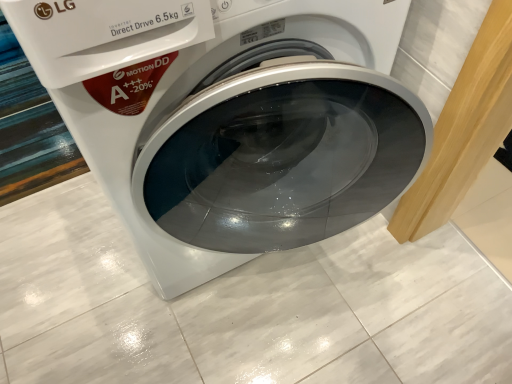
Question: Should I look upward or downward to see white glossy washing machine at center?

Choices:
 (A) up
 (B) down

Answer: (A)